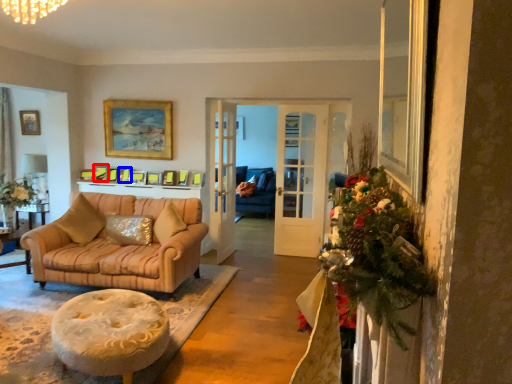
Question: Which object appears farthest to the camera in this image, picture frame (highlighted by a red box) or picture frame (highlighted by a blue box)?

Choices:
 (A) picture frame
 (B) picture frame

Answer: (A)